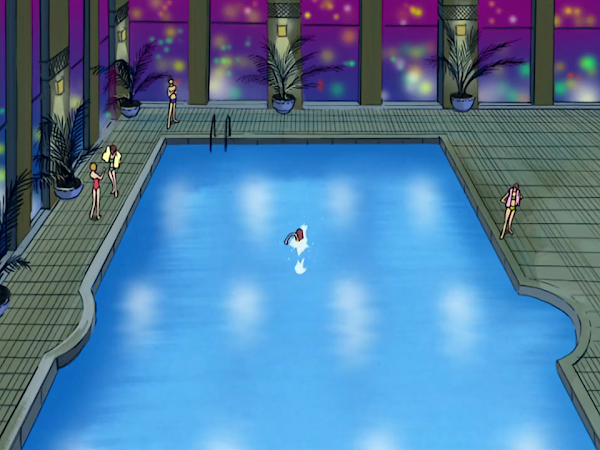
Find the location of a particular element. blue pots is located at coordinates (460, 103), (283, 105), (135, 109), (71, 191), (6, 305).